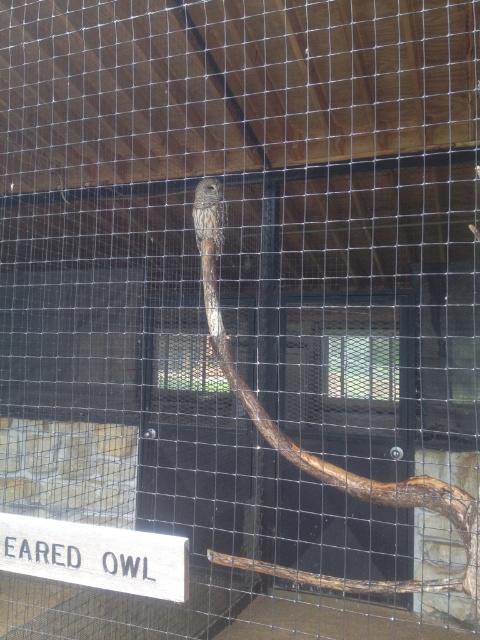
Consider the image. Can you confirm if brown rough branch at center is smaller than brown speckled feathers at center?

Incorrect, brown rough branch at center is not smaller in size than brown speckled feathers at center.

Who is more distant from viewer, (471, 528) or (213, 198)?

Point (213, 198)

Locate an element on the screen. The height and width of the screenshot is (640, 480). brown rough branch at center is located at coordinates pyautogui.click(x=344, y=477).

Can you confirm if brown rough branch at center is bigger than white wood sign at lower left?

Yes.

Does brown rough branch at center lie behind white wood sign at lower left?

No, it is not.

The width and height of the screenshot is (480, 640). What are the coordinates of `brown rough branch at center` in the screenshot? It's located at (344, 477).

You are a GUI agent. You are given a task and a screenshot of the screen. Output one action in this format:
    pyautogui.click(x=<x>, y=<y>)
    Task: Click on the brown rough branch at center
    The height and width of the screenshot is (640, 480).
    Given the screenshot: What is the action you would take?
    pyautogui.click(x=344, y=477)

Who is more distant from viewer, (48,552) or (207,186)?

Point (207,186)

Who is taller, white wood sign at lower left or brown speckled feathers at center?

brown speckled feathers at center

You are a GUI agent. You are given a task and a screenshot of the screen. Output one action in this format:
    pyautogui.click(x=<x>, y=<y>)
    Task: Click on the white wood sign at lower left
    The height and width of the screenshot is (640, 480).
    Given the screenshot: What is the action you would take?
    pyautogui.click(x=96, y=556)

The image size is (480, 640). In order to click on white wood sign at lower left in this screenshot , I will do `click(96, 556)`.